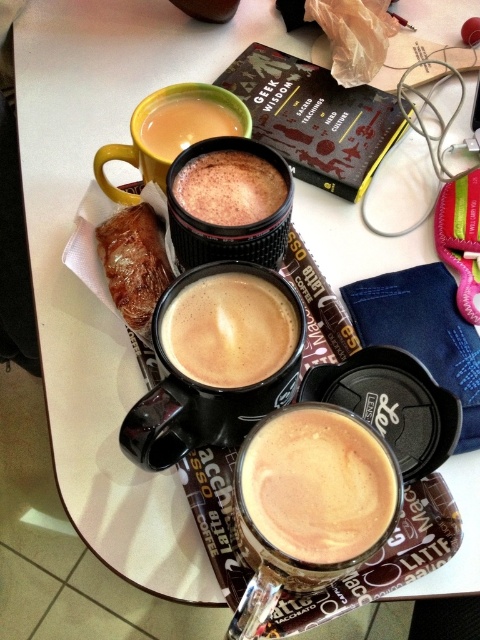
The width and height of the screenshot is (480, 640). What do you see at coordinates (171, 131) in the screenshot? I see `yellow matte mug at upper left` at bounding box center [171, 131].

Which is behind, point (207, 124) or point (162, 250)?

Point (207, 124)

What do you see at coordinates (171, 131) in the screenshot?
I see `yellow matte mug at upper left` at bounding box center [171, 131].

Identify the location of yellow matte mug at upper left. (171, 131).

Does point (242, 257) lie in front of point (140, 298)?

Yes, it is.

Where is `black matte cup at center`? The width and height of the screenshot is (480, 640). black matte cup at center is located at coordinates (228, 202).

Image resolution: width=480 pixels, height=640 pixels. Find the location of `cappuccino foam at center`. cappuccino foam at center is located at coordinates (317, 484).

Can you confirm if cappuccino foam at center is wider than matte black coffee cup at center?

Yes.

Where is `cappuccino foam at center`? The height and width of the screenshot is (640, 480). cappuccino foam at center is located at coordinates (317, 484).